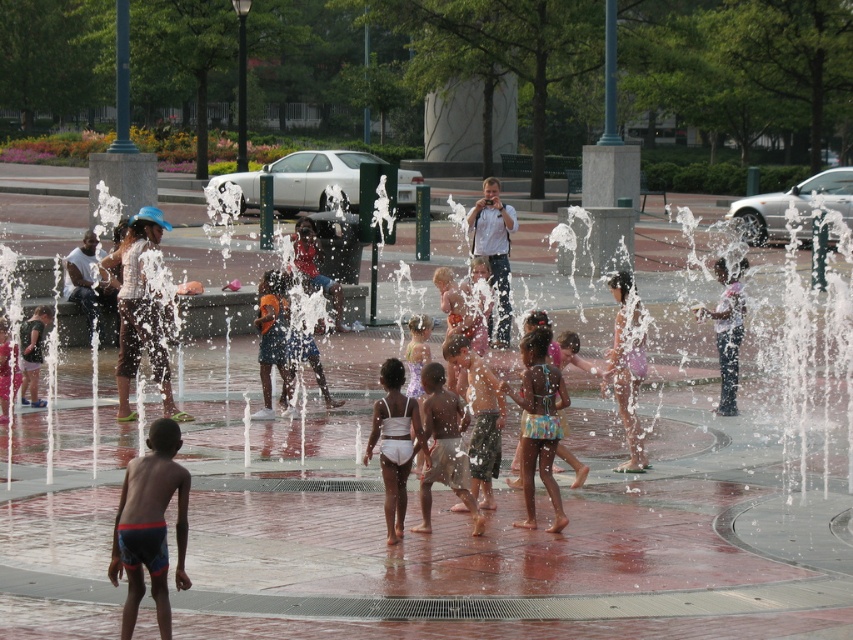
Question: Observing the image, what is the correct spatial positioning of matte black shirt at left in reference to matte black shorts at lower left?

Choices:
 (A) right
 (B) left

Answer: (B)

Question: Which object is the closest to the white cotton shirt at center?

Choices:
 (A) white matte swimsuit at center
 (B) purple fabric dress at center
 (C) matte blue shorts at center
 (D) clear plastic water at center

Answer: (C)

Question: Can you confirm if purple fabric dress at center is thinner than matte blue shorts at center?

Choices:
 (A) no
 (B) yes

Answer: (B)

Question: Observing the image, what is the correct spatial positioning of white matte swimsuit at center in reference to pink fabric dress at center?

Choices:
 (A) below
 (B) above

Answer: (A)

Question: Which of these objects is positioned farthest from the pink fabric dress at center?

Choices:
 (A) blue swim trunks at lower left
 (B) purple fabric dress at center
 (C) brown cotton shorts at center

Answer: (A)

Question: Which is nearer to the brown cotton shorts at center?

Choices:
 (A) blue swim trunks at lower left
 (B) matte black shorts at lower left

Answer: (B)